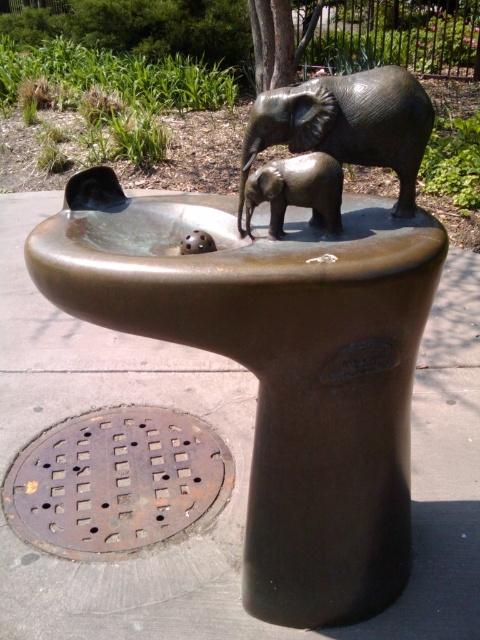
Question: In this image, where is bronze/textured elephant at upper center located relative to rusty metal manhole cover at lower left?

Choices:
 (A) above
 (B) below

Answer: (A)

Question: Considering the relative positions of rusty metal manhole cover at lower left and bronze baby elephant at center in the image provided, where is rusty metal manhole cover at lower left located with respect to bronze baby elephant at center?

Choices:
 (A) left
 (B) right

Answer: (A)

Question: In this image, where is bronze/textured elephant at upper center located relative to bronze baby elephant at center?

Choices:
 (A) right
 (B) left

Answer: (A)

Question: Among these objects, which one is farthest from the camera?

Choices:
 (A) rusty metal manhole cover at lower left
 (B) bronze/textured elephant at upper center
 (C) bronze baby elephant at center
 (D) bronze textured elephant at center

Answer: (A)

Question: Which object is positioned closest to the bronze textured elephant at center?

Choices:
 (A) bronze baby elephant at center
 (B) rusty metal manhole cover at lower left
 (C) bronze/textured elephant at upper center

Answer: (A)

Question: Among these objects, which one is farthest from the camera?

Choices:
 (A) bronze textured elephant at center
 (B) bronze baby elephant at center
 (C) bronze/textured elephant at upper center
 (D) rusty metal manhole cover at lower left

Answer: (D)